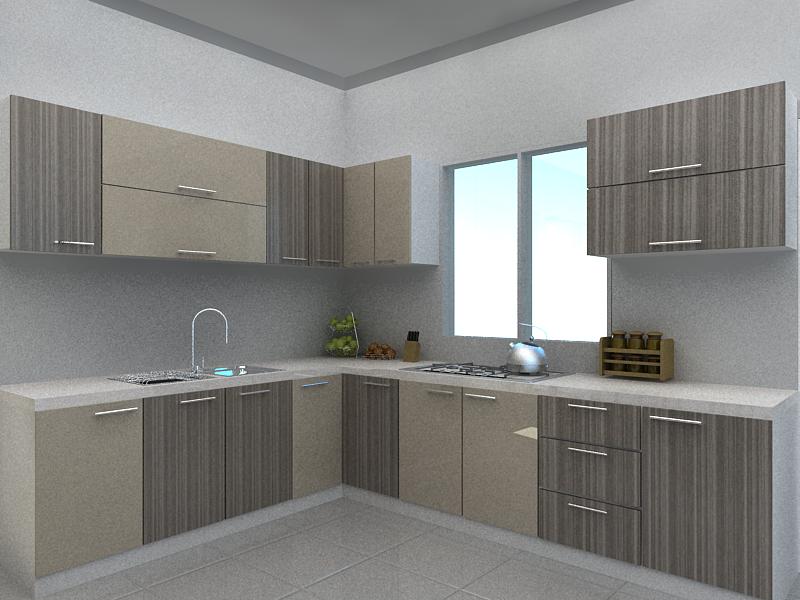
Find the location of a particular element. The height and width of the screenshot is (600, 800). drawer is located at coordinates (601, 421).